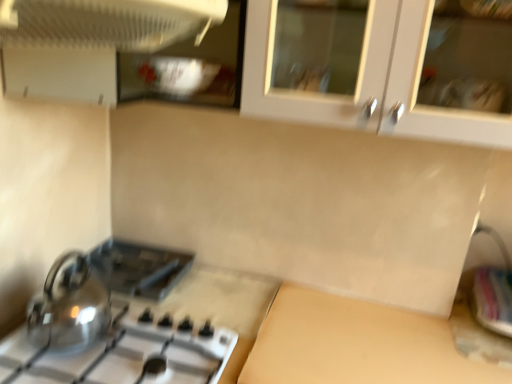
Question: From the image's perspective, is metallic silver sink at lower right above white plastic fan at upper left, which ranks as the second kitchen appliance in bottom-to-top order?

Choices:
 (A) yes
 (B) no

Answer: (B)

Question: Is metallic silver sink at lower right closer to the viewer compared to white plastic fan at upper left, the 1th kitchen appliance viewed from the top?

Choices:
 (A) yes
 (B) no

Answer: (B)

Question: Can you confirm if metallic silver sink at lower right is bigger than white plastic fan at upper left, which ranks as the second kitchen appliance in bottom-to-top order?

Choices:
 (A) yes
 (B) no

Answer: (B)

Question: From a real-world perspective, is metallic silver sink at lower right located beneath white plastic fan at upper left, which is the 2th kitchen appliance from back to front?

Choices:
 (A) yes
 (B) no

Answer: (A)

Question: Considering the relative sizes of metallic silver sink at lower right and white plastic fan at upper left, the 1th kitchen appliance viewed from the top, in the image provided, is metallic silver sink at lower right wider than white plastic fan at upper left, the 1th kitchen appliance viewed from the top,?

Choices:
 (A) no
 (B) yes

Answer: (A)

Question: From the image's perspective, would you say metallic silver sink at lower right is shown under white plastic fan at upper left, which ranks as the second kitchen appliance in bottom-to-top order?

Choices:
 (A) yes
 (B) no

Answer: (A)

Question: Is white plastic fan at upper left, the first kitchen appliance from the front, wider than shiny metallic gas stove at lower left?

Choices:
 (A) no
 (B) yes

Answer: (A)

Question: Is white plastic fan at upper left, the 1th kitchen appliance viewed from the top, at the left side of shiny metallic gas stove at lower left?

Choices:
 (A) no
 (B) yes

Answer: (A)

Question: Is white plastic fan at upper left, which is the 2th kitchen appliance from back to front, directly adjacent to shiny metallic gas stove at lower left?

Choices:
 (A) yes
 (B) no

Answer: (B)

Question: Is white plastic fan at upper left, the first kitchen appliance from the front, not close to shiny metallic gas stove at lower left?

Choices:
 (A) yes
 (B) no

Answer: (B)

Question: From the image's perspective, would you say white plastic fan at upper left, which is the 2th kitchen appliance from back to front, is positioned over shiny metallic gas stove at lower left?

Choices:
 (A) yes
 (B) no

Answer: (A)

Question: Is white plastic fan at upper left, the first kitchen appliance from the front, thinner than shiny metallic gas stove at lower left?

Choices:
 (A) yes
 (B) no

Answer: (A)

Question: Is white plastic fan at upper left, which ranks as the second kitchen appliance in bottom-to-top order, aimed at shiny metallic kettle at lower left, which is the 1th kitchen appliance from bottom to top?

Choices:
 (A) yes
 (B) no

Answer: (B)